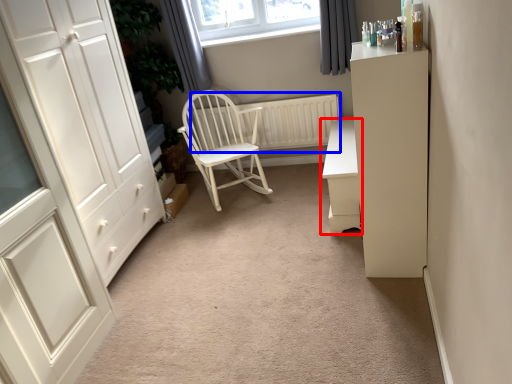
Question: Among these objects, which one is farthest to the camera, chest of drawers (highlighted by a red box) or radiator (highlighted by a blue box)?

Choices:
 (A) chest of drawers
 (B) radiator

Answer: (B)